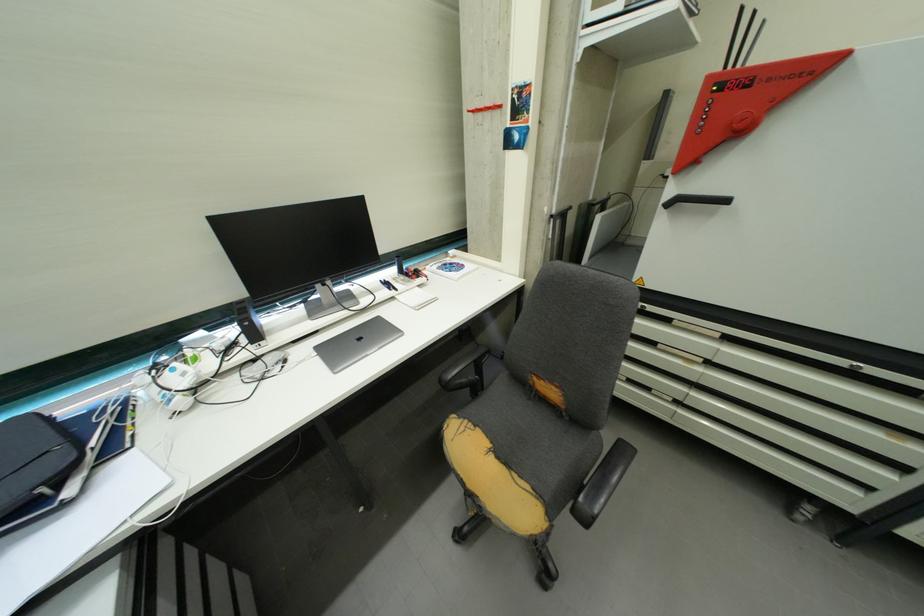
Locate an element on the screen. white computer mouse is located at coordinates (174, 384).